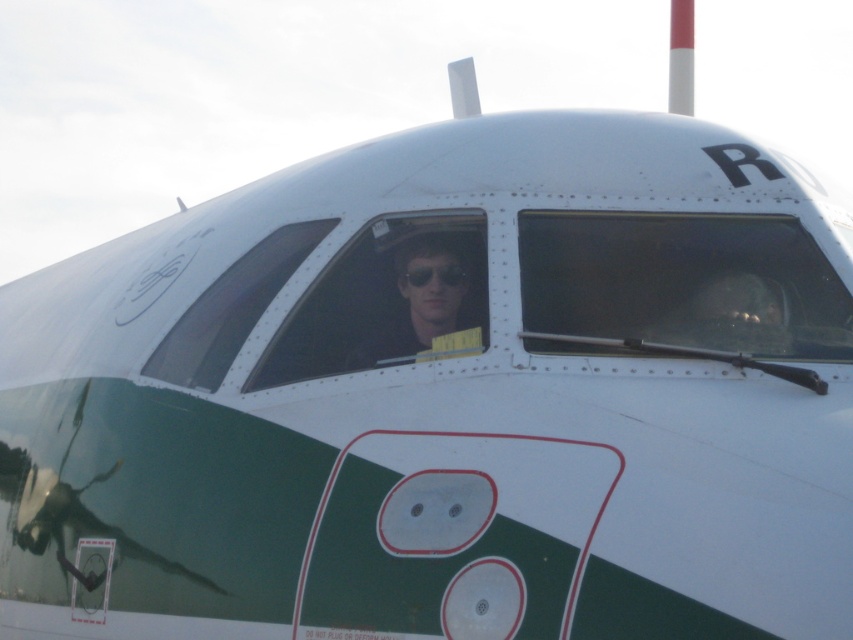
You are a flight attendant who needs to store the matte black sunglasses at center and the black matte goggles at center in a compartment. The compartment can only fit one item at a time. Which item should you store first to ensure the smaller one fits afterward?

The black matte goggles at center should be stored first because it is smaller than the matte black sunglasses at center, allowing the larger sunglasses to fit afterward.